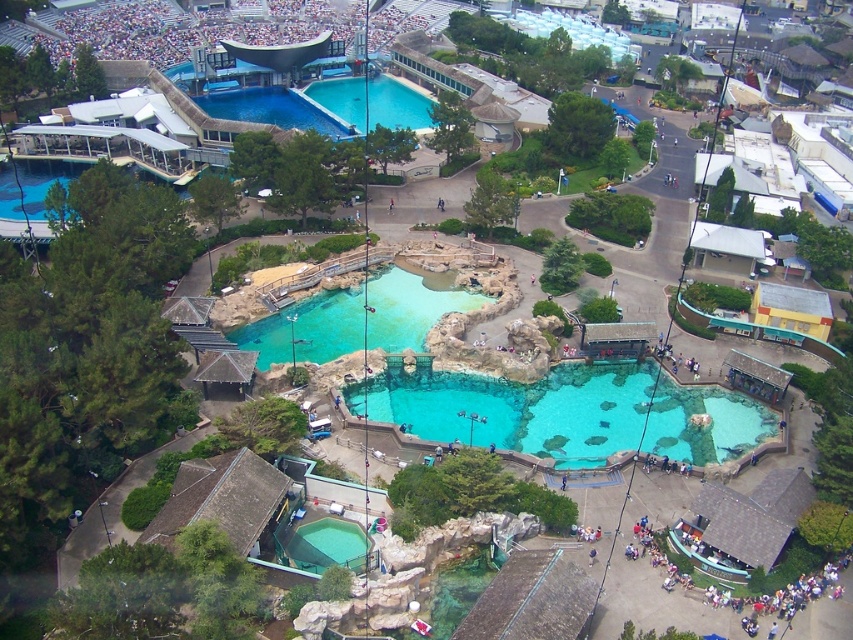
Which is more to the right, turquoise glass pool at center or clear blue water at upper center?

turquoise glass pool at center

Is turquoise glass pool at center behind clear blue water at upper center?

No, it is in front of clear blue water at upper center.

Between point (386, 268) and point (422, 97), which one is positioned behind?

The point (422, 97) is behind.

The image size is (853, 640). Find the location of `turquoise glass pool at center`. turquoise glass pool at center is located at coordinates (306, 330).

Does clear glass pool at center have a greater height compared to turquoise glass pool at center?

No.

Who is more forward, [489,390] or [300,321]?

Point [489,390] is more forward.

Find the location of a particular element. Image resolution: width=853 pixels, height=640 pixels. clear glass pool at center is located at coordinates (523, 408).

Between clear glass pool at center and clear blue water at upper center, which one is positioned higher?

clear blue water at upper center

Does point (618, 435) lie behind point (381, 84)?

No, (618, 435) is in front of (381, 84).

What do you see at coordinates (523, 408) in the screenshot? I see `clear glass pool at center` at bounding box center [523, 408].

You are a GUI agent. You are given a task and a screenshot of the screen. Output one action in this format:
    pyautogui.click(x=<x>, y=<y>)
    Task: Click on the clear glass pool at center
    
    Given the screenshot: What is the action you would take?
    pyautogui.click(x=523, y=408)